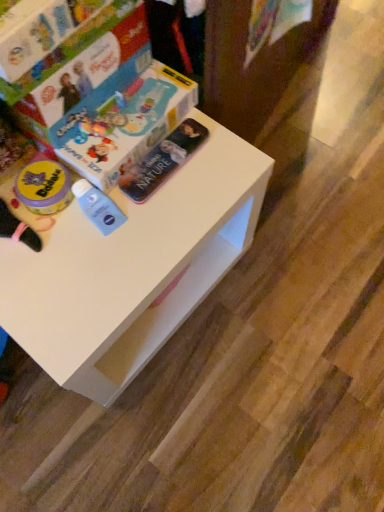
Question: Is hardcover book at upper left, the second paperback book ordered from the bottom, placed right next to metallic silver book at center, positioned as the 2th paperback book in top-to-bottom order?

Choices:
 (A) yes
 (B) no

Answer: (B)

Question: Is hardcover book at upper left, the second paperback book ordered from the bottom, surrounding metallic silver book at center, positioned as the 2th paperback book in top-to-bottom order?

Choices:
 (A) yes
 (B) no

Answer: (B)

Question: From the image's perspective, is hardcover book at upper left, which is the first paperback book from top to bottom, located beneath metallic silver book at center, marked as the 1th paperback book in a bottom-to-top arrangement?

Choices:
 (A) no
 (B) yes

Answer: (A)

Question: Considering the relative sizes of hardcover book at upper left, the second paperback book ordered from the bottom, and metallic silver book at center, positioned as the 2th paperback book in top-to-bottom order, in the image provided, is hardcover book at upper left, the second paperback book ordered from the bottom, taller than metallic silver book at center, positioned as the 2th paperback book in top-to-bottom order,?

Choices:
 (A) no
 (B) yes

Answer: (B)

Question: From a real-world perspective, is hardcover book at upper left, which is the first paperback book from top to bottom, positioned under metallic silver book at center, positioned as the 2th paperback book in top-to-bottom order, based on gravity?

Choices:
 (A) yes
 (B) no

Answer: (B)

Question: Considering the relative positions of white matte table at center and hardcover book at upper left, which is the first paperback book from top to bottom, in the image provided, is white matte table at center to the left or to the right of hardcover book at upper left, which is the first paperback book from top to bottom,?

Choices:
 (A) left
 (B) right

Answer: (B)

Question: Is point (51, 302) closer or farther from the camera than point (54, 122)?

Choices:
 (A) closer
 (B) farther

Answer: (A)

Question: From a real-world perspective, is white matte table at center physically located above or below hardcover book at upper left, which is the first paperback book from top to bottom?

Choices:
 (A) below
 (B) above

Answer: (A)

Question: In terms of width, does white matte table at center look wider or thinner when compared to hardcover book at upper left, the second paperback book ordered from the bottom?

Choices:
 (A) wide
 (B) thin

Answer: (A)

Question: Considering their positions, is hardcover book at upper left, which is the first paperback book from top to bottom, located in front of or behind white matte table at center?

Choices:
 (A) behind
 (B) front

Answer: (A)

Question: From the image's perspective, relative to white matte table at center, is hardcover book at upper left, the second paperback book ordered from the bottom, above or below?

Choices:
 (A) above
 (B) below

Answer: (A)

Question: From a real-world perspective, is hardcover book at upper left, the second paperback book ordered from the bottom, positioned above or below white matte table at center?

Choices:
 (A) below
 (B) above

Answer: (B)

Question: From their relative heights in the image, would you say hardcover book at upper left, the second paperback book ordered from the bottom, is taller or shorter than white matte table at center?

Choices:
 (A) short
 (B) tall

Answer: (A)

Question: In terms of height, does metallic silver book at center, positioned as the 2th paperback book in top-to-bottom order, look taller or shorter compared to hardcover book at upper left, the second paperback book ordered from the bottom?

Choices:
 (A) short
 (B) tall

Answer: (A)

Question: Is metallic silver book at center, positioned as the 2th paperback book in top-to-bottom order, bigger or smaller than hardcover book at upper left, which is the first paperback book from top to bottom?

Choices:
 (A) small
 (B) big

Answer: (A)